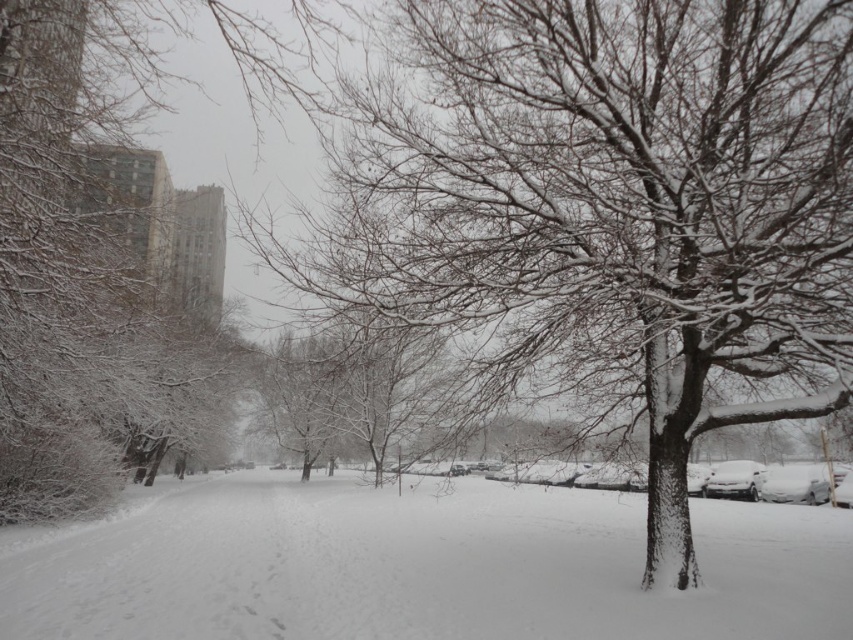
Is point (303, 618) positioned before point (47, 246)?

That is True.

Does white fluffy snow at center have a smaller size compared to snow-covered tree at left?

Yes, white fluffy snow at center is smaller than snow-covered tree at left.

The image size is (853, 640). Describe the element at coordinates (422, 566) in the screenshot. I see `white fluffy snow at center` at that location.

Identify the location of white fluffy snow at center. The width and height of the screenshot is (853, 640). (422, 566).

How far apart are snow-covered tree at center and white fluffy snow at center?

A distance of 13.98 meters exists between snow-covered tree at center and white fluffy snow at center.

Is snow-covered tree at center to the left of white fluffy snow at center from the viewer's perspective?

No, snow-covered tree at center is not to the left of white fluffy snow at center.

Which is behind, point (540, 92) or point (221, 490)?

The point (221, 490) is more distant.

I want to click on snow-covered tree at center, so click(x=606, y=208).

Between snow-covered tree at center and snow-covered tree at left, which one appears on the left side from the viewer's perspective?

snow-covered tree at left

Which is behind, point (485, 307) or point (189, 296)?

The point (189, 296) is more distant.

Who is more forward, (666, 26) or (62, 346)?

Point (666, 26) is in front.

Where is `snow-covered tree at center`? Image resolution: width=853 pixels, height=640 pixels. snow-covered tree at center is located at coordinates (606, 208).